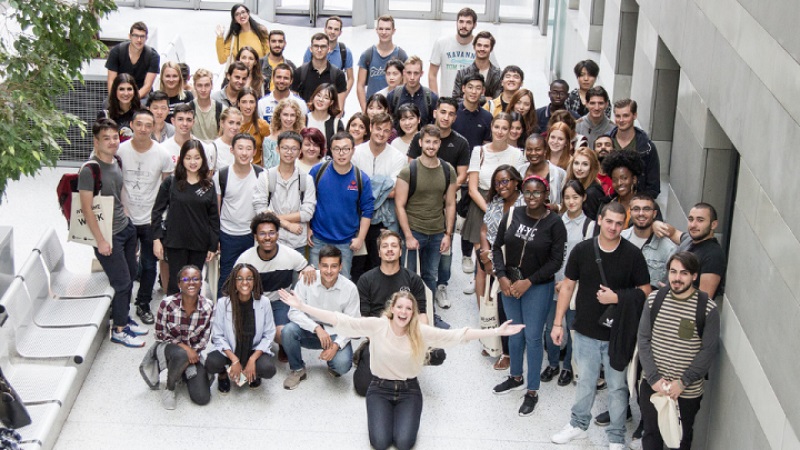
You are a GUI agent. You are given a task and a screenshot of the screen. Output one action in this format:
    pyautogui.click(x=<x>, y=<y>)
    Task: Click on the chairs
    
    Given the screenshot: What is the action you would take?
    (77, 283), (76, 309), (62, 338), (40, 378), (36, 411)